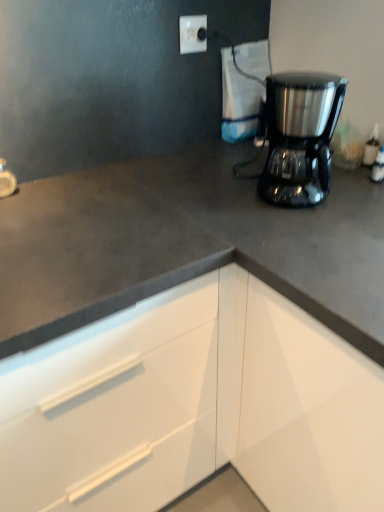
Where is `vacant space situated above white glossy cabinet at lower right (from a real-world perspective)`? This screenshot has width=384, height=512. vacant space situated above white glossy cabinet at lower right (from a real-world perspective) is located at coordinates (143, 204).